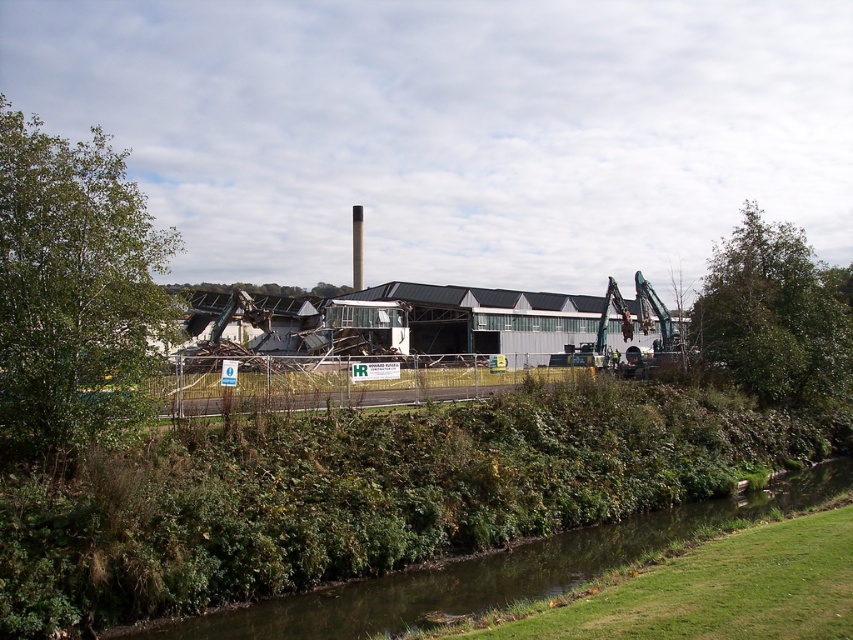
You are standing at the point marked as point (73, 292) in the industrial site. What is the nearest object to you?

The nearest object to you is the green leafy tree at left, as the point (73, 292) is located on it.

You are a worker at the industrial site. You need to place a new safety barrier between the green leafy tree at left and the green grassy river at lower center. Which object should the barrier be placed closer to?

The barrier should be placed closer to the green grassy river at lower center because the green leafy tree at left is located above it, meaning the river is lower in position.

You are a construction worker standing at the demolition site. You need to cross from the heavy machinery to the building. The green grassy river at lower center and the green leafy tree at upper right are in your path. Which object is narrower, making it easier to navigate around?

The green grassy river at lower center has a lesser width compared to the green leafy tree at upper right, so it is narrower and easier to navigate around.